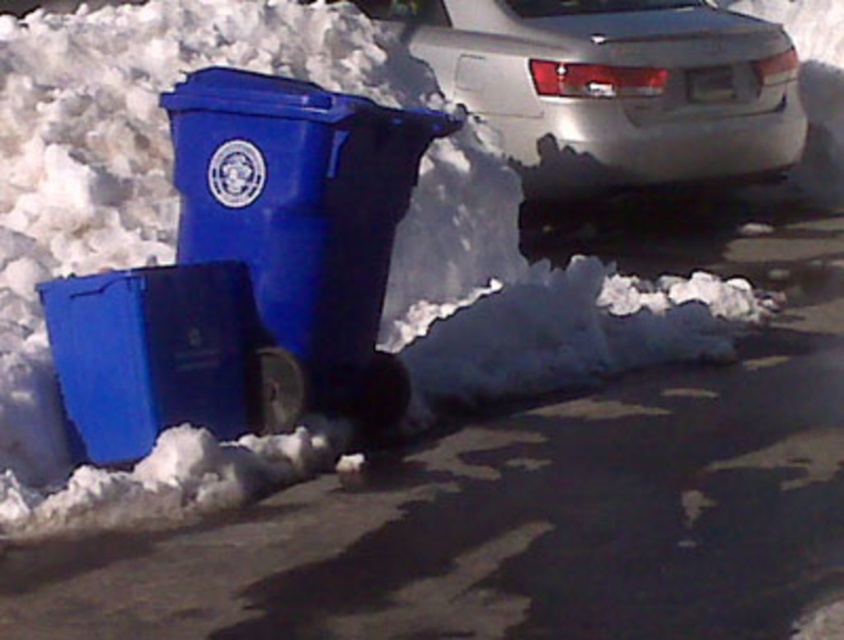
Does silver metallic sedan at upper right lie behind matte plastic recycling bin at left?

That is True.

Between point (556, 74) and point (195, 113), which one is positioned in front?

Point (195, 113) is in front.

Locate an element on the screen. The height and width of the screenshot is (640, 844). silver metallic sedan at upper right is located at coordinates (613, 86).

Is the position of smooth asphalt at lower center more distant than that of matte plastic recycling bin at left?

No, smooth asphalt at lower center is closer to the viewer.

In the scene shown: Which is above, smooth asphalt at lower center or matte plastic recycling bin at left?

matte plastic recycling bin at left

Locate an element on the screen. smooth asphalt at lower center is located at coordinates (533, 499).

At what (x,y) coordinates should I click in order to perform the action: click on smooth asphalt at lower center. Please return your answer as a coordinate pair (x, y). The height and width of the screenshot is (640, 844). Looking at the image, I should click on (533, 499).

Which of these two, smooth asphalt at lower center or silver metallic sedan at upper right, stands shorter?

Standing shorter between the two is smooth asphalt at lower center.

At what (x,y) coordinates should I click in order to perform the action: click on smooth asphalt at lower center. Please return your answer as a coordinate pair (x, y). This screenshot has height=640, width=844. Looking at the image, I should click on (533, 499).